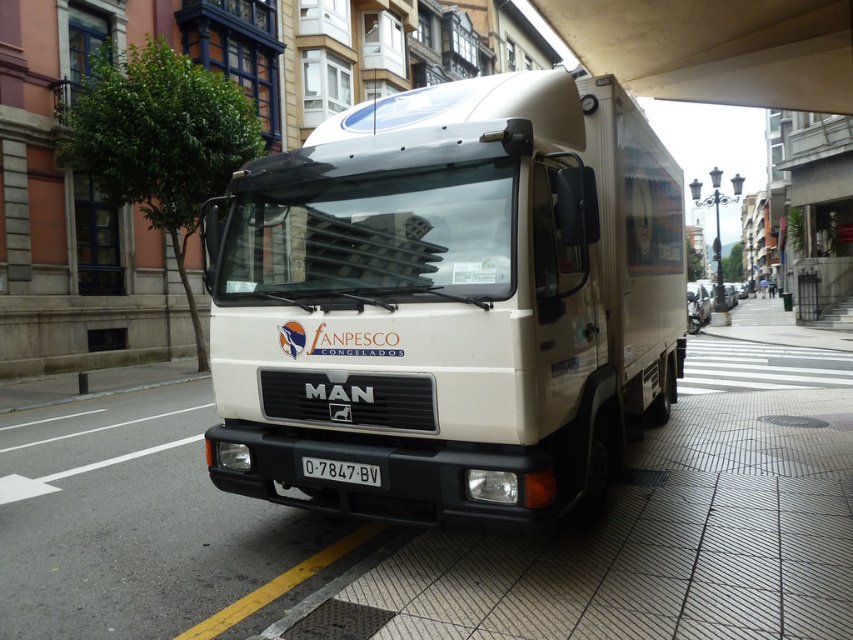
Question: Does white matte truck at center come in front of white plastic license plate at center?

Choices:
 (A) yes
 (B) no

Answer: (A)

Question: Which is farther from the white tile pavement at center?

Choices:
 (A) white matte truck at center
 (B) white plastic license plate at center

Answer: (B)

Question: Which of the following is the closest to the observer?

Choices:
 (A) (146, 410)
 (B) (347, 477)
 (C) (358, 125)

Answer: (B)

Question: Which point is closer to the camera?

Choices:
 (A) (511, 83)
 (B) (312, 477)
 (C) (303, 522)

Answer: (B)

Question: Does white matte truck at center have a greater width compared to white plastic license plate at center?

Choices:
 (A) yes
 (B) no

Answer: (A)

Question: Is white matte truck at center to the right of white tile pavement at center from the viewer's perspective?

Choices:
 (A) no
 (B) yes

Answer: (A)